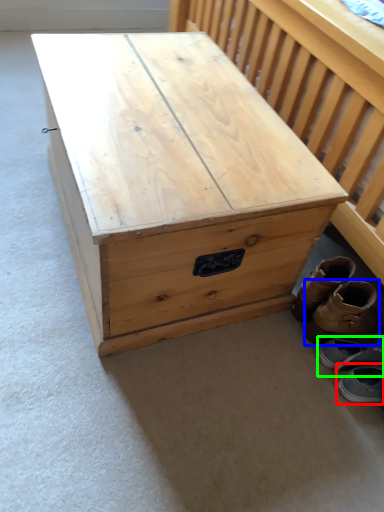
Question: Based on their relative distances, which object is farther from footwear (highlighted by a red box)? Choose from footwear (highlighted by a blue box) and footwear (highlighted by a green box).

Choices:
 (A) footwear
 (B) footwear

Answer: (A)